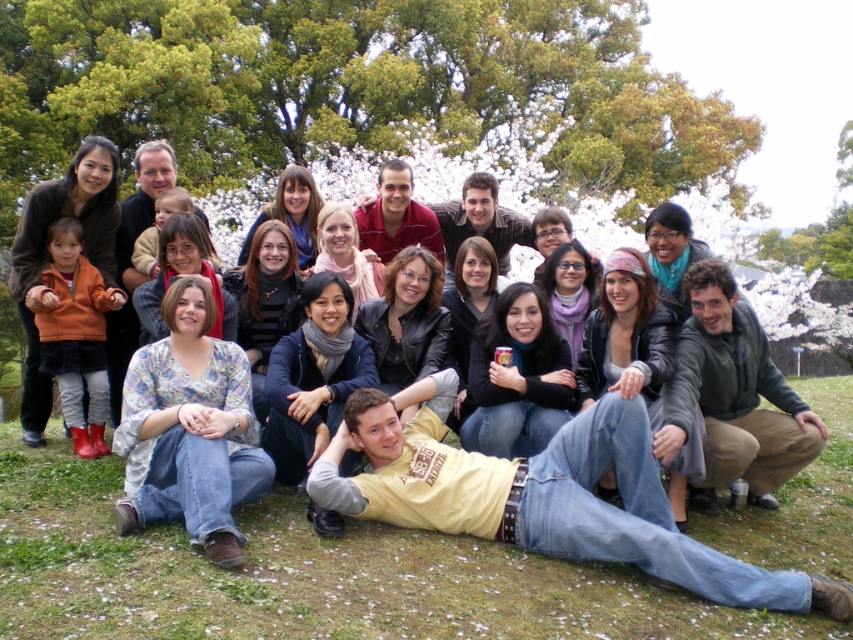
Question: Which point is closer to the camera?

Choices:
 (A) floral-patterned blouse at center
 (B) matte black jacket at center
 (C) orange fleece jacket at left
 (D) dark gray fleece jacket at lower right

Answer: (A)

Question: Where is orange fleece jacket at left located in relation to matte black jacket at center in the image?

Choices:
 (A) right
 (B) left

Answer: (A)

Question: Does green grass at lower center appear on the left side of dark gray fleece jacket at lower right?

Choices:
 (A) yes
 (B) no

Answer: (A)

Question: Among these points, which one is nearest to the camera?

Choices:
 (A) (309, 240)
 (B) (21, 275)
 (C) (210, 467)
 (D) (88, 560)

Answer: (D)

Question: Which object is positioned farthest from the dark gray fleece jacket at lower right?

Choices:
 (A) matte black jacket at center
 (B) green grass at lower center

Answer: (A)

Question: Is dark gray fleece jacket at lower right bigger than matte red shirt at center?

Choices:
 (A) yes
 (B) no

Answer: (A)